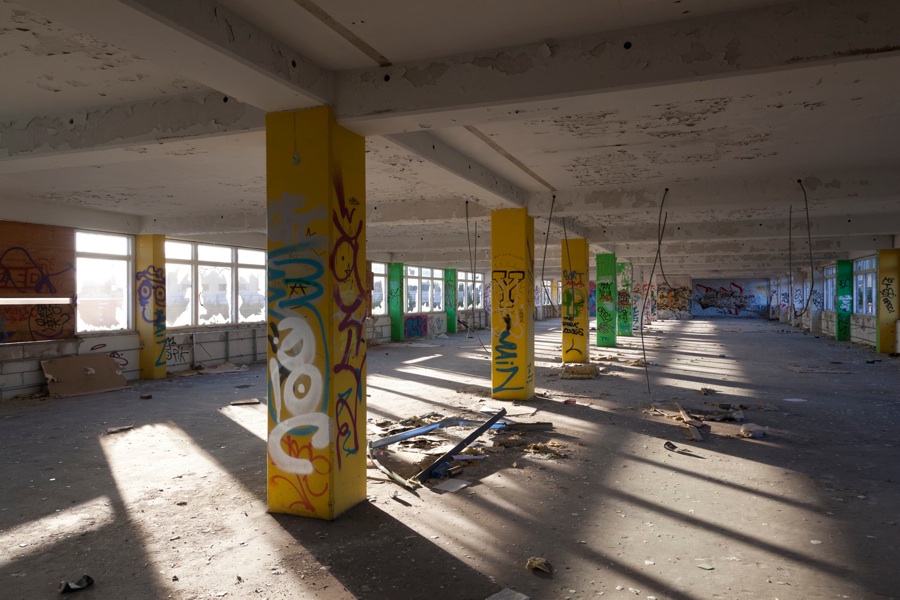
Find the location of a particular element. The width and height of the screenshot is (900, 600). broken windows is located at coordinates (x=105, y=293), (x=184, y=287), (x=220, y=287), (x=373, y=293), (x=405, y=287), (x=420, y=287), (x=441, y=289), (x=465, y=292).